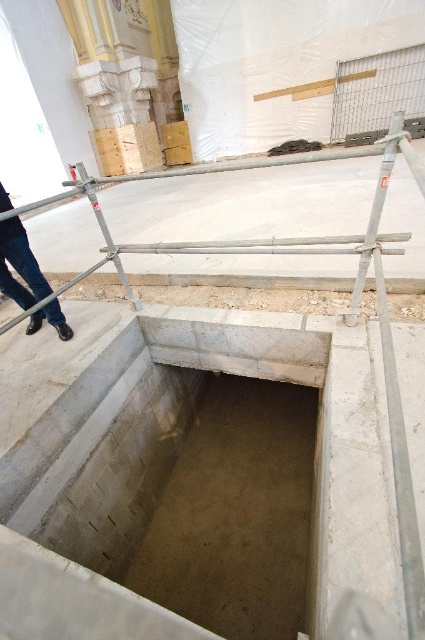
Question: Which of the following is the closest to the observer?

Choices:
 (A) blue jeans at left
 (B) metal scaffolding at center

Answer: (B)

Question: Among these points, which one is farthest from the camera?

Choices:
 (A) (40, 273)
 (B) (104, 179)

Answer: (B)

Question: Considering the relative positions of metal scaffolding at center and blue jeans at left in the image provided, where is metal scaffolding at center located with respect to blue jeans at left?

Choices:
 (A) below
 (B) above

Answer: (B)

Question: Is metal scaffolding at center positioned at the back of blue jeans at left?

Choices:
 (A) no
 (B) yes

Answer: (A)

Question: Is metal scaffolding at center below blue jeans at left?

Choices:
 (A) yes
 (B) no

Answer: (B)